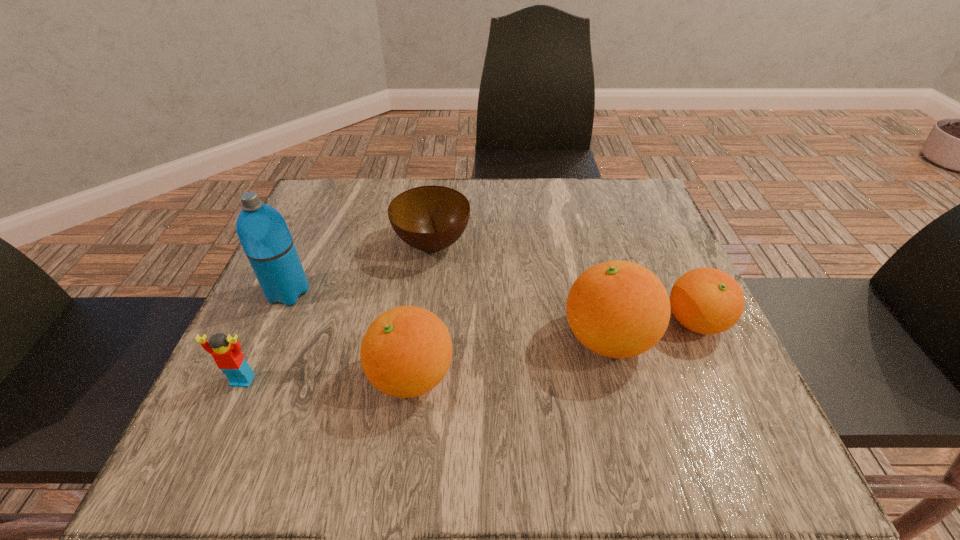
Please mark a free spot for a new orange_(fruit) to balance the arrangement. Please provide its 2D coordinates. Your answer should be formatted as a tuple, i.e. [(x, y)], where the tuple contains the x and y coordinates of a point satisfying the conditions above.

[(514, 356)]